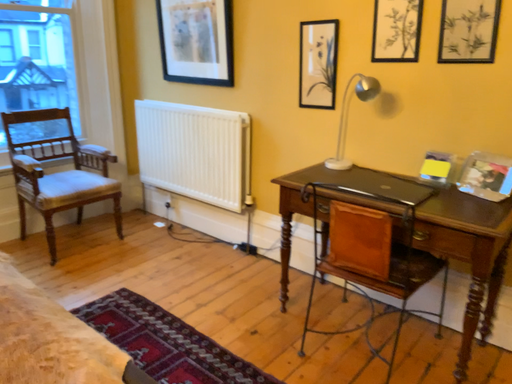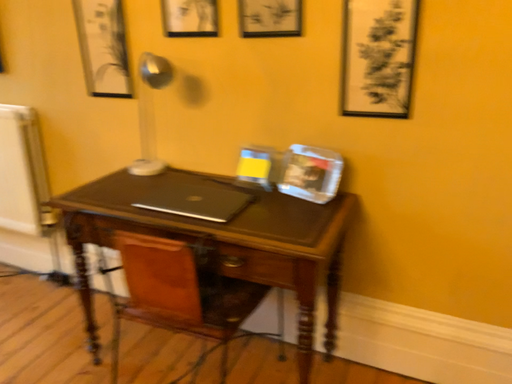
Question: Which way did the camera rotate in the video?

Choices:
 (A) rotated left
 (B) rotated right

Answer: (B)